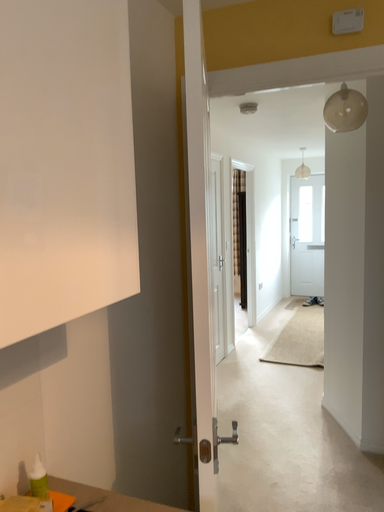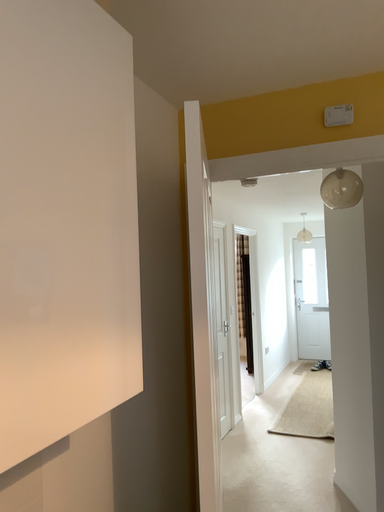
Question: Which way did the camera rotate in the video?

Choices:
 (A) rotated upward
 (B) rotated downward

Answer: (A)